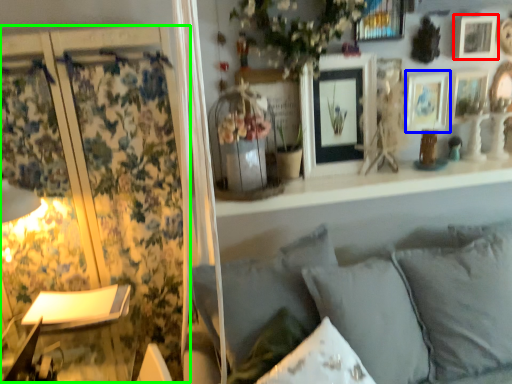
Question: Which is nearer to the picture frame (highlighted by a red box)? picture frame (highlighted by a blue box) or curtain (highlighted by a green box).

Choices:
 (A) picture frame
 (B) curtain

Answer: (A)